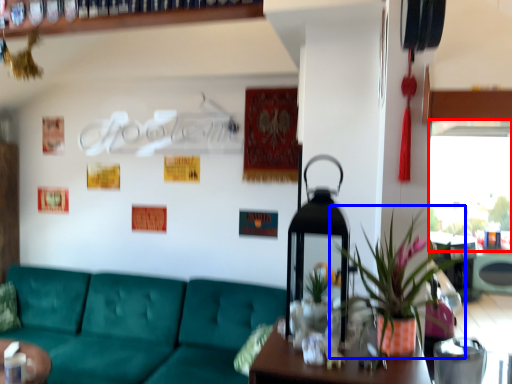
Question: Which of the following is the farthest to the observer, window screen (highlighted by a red box) or houseplant (highlighted by a blue box)?

Choices:
 (A) window screen
 (B) houseplant

Answer: (A)